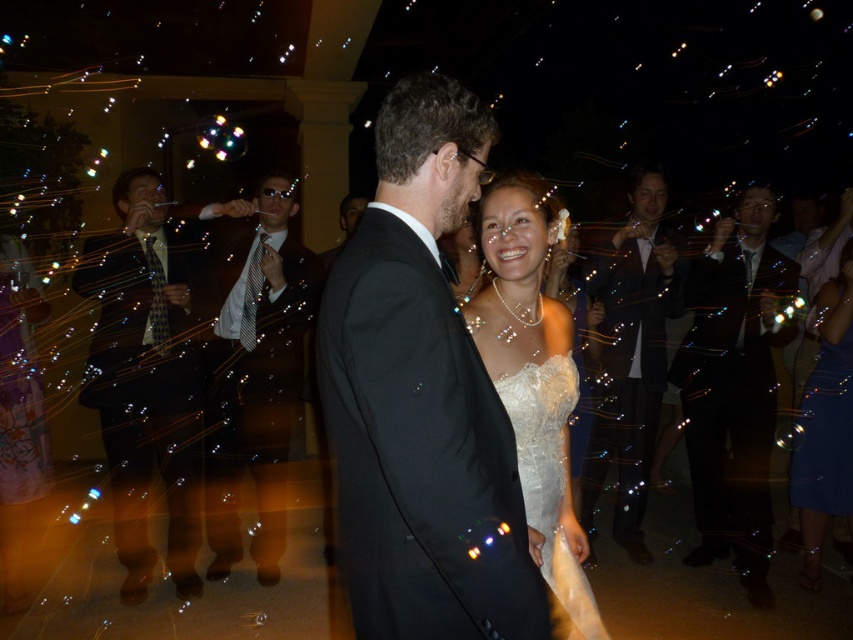
Between white satin dress at center and white lace dress at center, which one has more height?

With more height is white satin dress at center.

Measure the distance between point (579, 561) and camera.

Point (579, 561) and camera are 1.99 meters apart from each other.

Image resolution: width=853 pixels, height=640 pixels. What do you see at coordinates (532, 381) in the screenshot?
I see `white satin dress at center` at bounding box center [532, 381].

Find the location of a particular element. white satin dress at center is located at coordinates (532, 381).

What do you see at coordinates (421, 397) in the screenshot?
I see `black satin suit at center` at bounding box center [421, 397].

Can you confirm if black satin suit at center is shorter than shiny black suit at center?

Correct, black satin suit at center is not as tall as shiny black suit at center.

Which is in front, point (509, 518) or point (229, 371)?

Positioned in front is point (509, 518).

Where is `black satin suit at center`? This screenshot has width=853, height=640. black satin suit at center is located at coordinates (421, 397).

Can you confirm if shiny black suit at left is taller than black satin suit at right?

In fact, shiny black suit at left may be shorter than black satin suit at right.

Is shiny black suit at left thinner than black satin suit at right?

Yes.

Is point (170, 244) closer to viewer compared to point (608, 256)?

Yes, point (170, 244) is closer to viewer.

The width and height of the screenshot is (853, 640). Identify the location of shiny black suit at left. (146, 378).